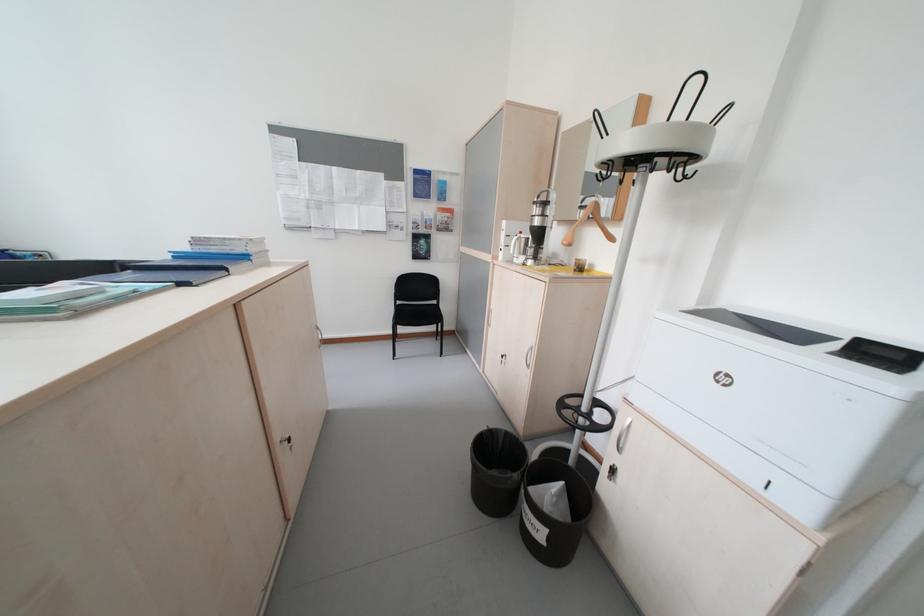
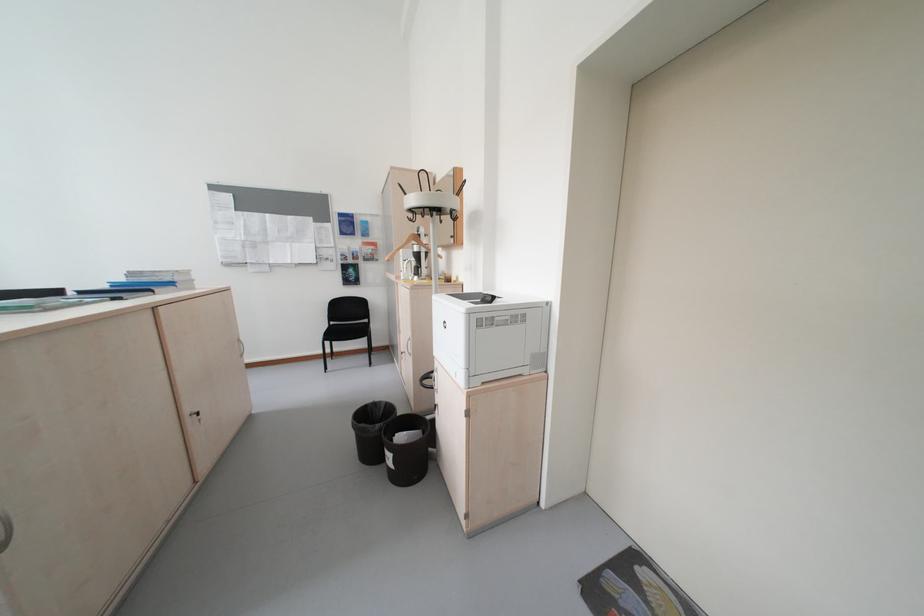
Find the pixel in the second image that matches [541,350] in the first image.

(419, 341)